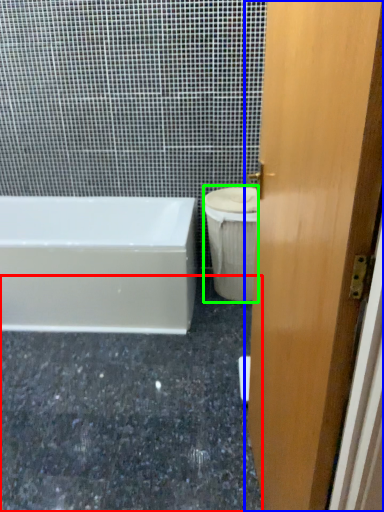
Question: Considering the real-world distances, which object is closest to granite (highlighted by a red box)? door (highlighted by a blue box) or toilet bowl (highlighted by a green box).

Choices:
 (A) door
 (B) toilet bowl

Answer: (B)